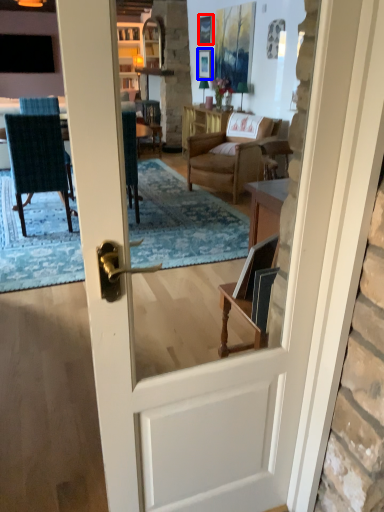
Question: Which point is further to the camera, picture frame (highlighted by a red box) or picture frame (highlighted by a blue box)?

Choices:
 (A) picture frame
 (B) picture frame

Answer: (B)